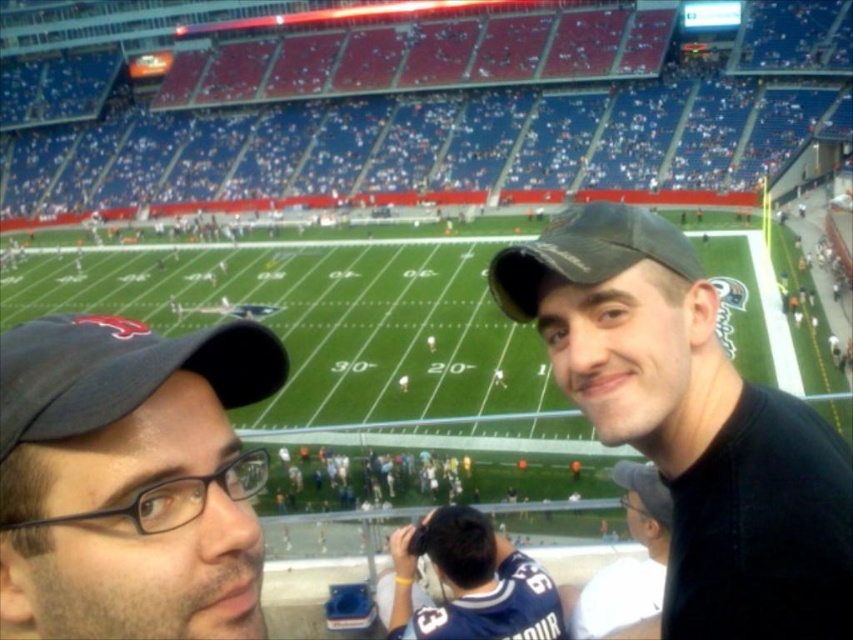
Question: Which point is farther to the camera?

Choices:
 (A) black matte baseball cap at right
 (B) black matte cap at upper right
 (C) blue jersey at center

Answer: (C)

Question: Which of these objects is positioned farthest from the blue jersey at center?

Choices:
 (A) black matte baseball cap at right
 (B) matte black baseball cap at left
 (C) black matte cap at upper right

Answer: (B)

Question: Is black matte cap at upper right smaller than matte black baseball cap at left?

Choices:
 (A) yes
 (B) no

Answer: (A)

Question: Does matte black baseball cap at left have a larger size compared to blue jersey at center?

Choices:
 (A) yes
 (B) no

Answer: (A)

Question: Which object is the farthest from the white matte cap at upper right?

Choices:
 (A) black matte baseball cap at right
 (B) matte black baseball cap at left
 (C) blue jersey at center

Answer: (B)

Question: In this image, where is black matte cap at upper right located relative to matte black baseball cap at left?

Choices:
 (A) below
 (B) above

Answer: (A)